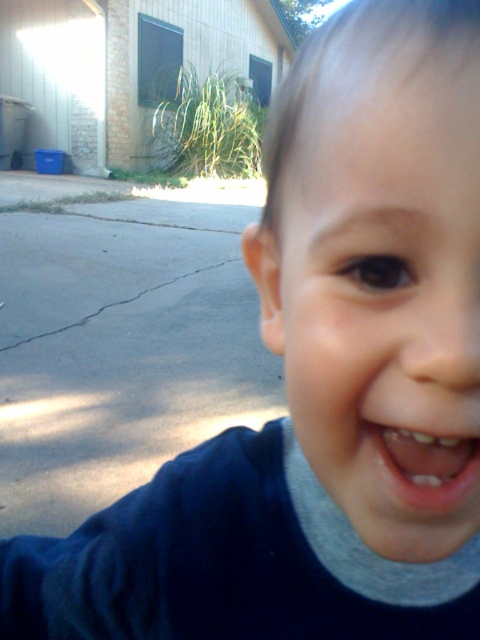
Can you confirm if smooth skin face at center is positioned above pink flesh-colored mouth at lower center?

Yes.

Who is more distant from viewer, (x=346, y=484) or (x=377, y=448)?

Positioned behind is point (x=346, y=484).

Image resolution: width=480 pixels, height=640 pixels. In order to click on smooth skin face at center in this screenshot , I will do `click(384, 298)`.